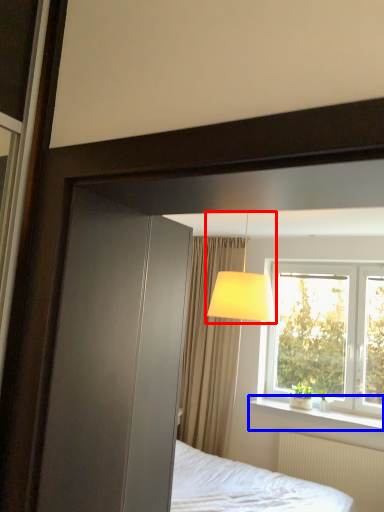
Question: Which object appears closest to the camera in this image, table lamp (highlighted by a red box) or window sill (highlighted by a blue box)?

Choices:
 (A) table lamp
 (B) window sill

Answer: (A)